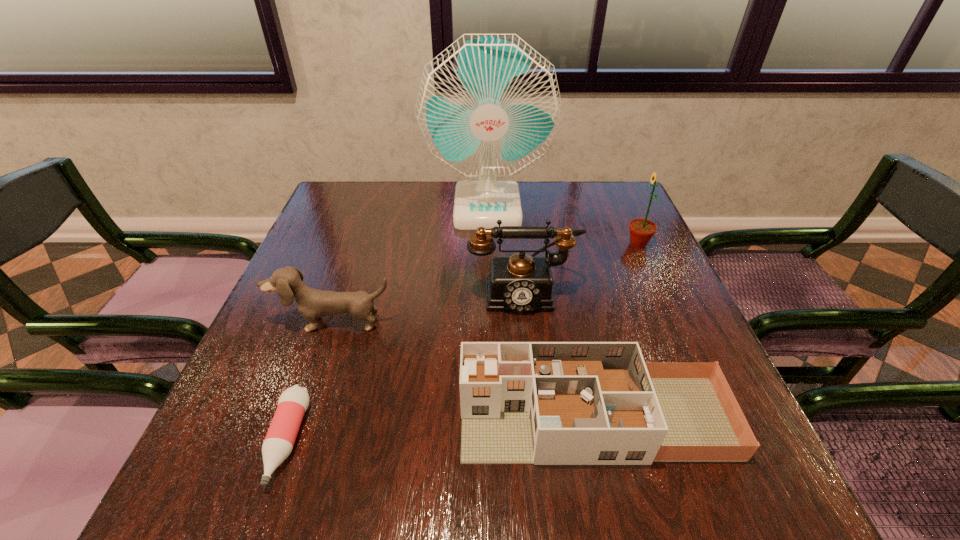
Where is `bottle that is positioned at the left edge`? bottle that is positioned at the left edge is located at coordinates (279, 441).

Where is `sunflower located in the right edge section of the desktop`? The image size is (960, 540). sunflower located in the right edge section of the desktop is located at coordinates (641, 230).

At what (x,y) coordinates should I click in order to perform the action: click on dollhouse that is positioned at the right edge. Please return your answer as a coordinate pair (x, y). Looking at the image, I should click on (545, 403).

This screenshot has width=960, height=540. I want to click on object positioned at the near left corner, so click(x=279, y=441).

The height and width of the screenshot is (540, 960). Find the location of `object situated at the near right corner`. object situated at the near right corner is located at coordinates (545, 403).

Where is `free space at the far edge of the desktop`? The height and width of the screenshot is (540, 960). free space at the far edge of the desktop is located at coordinates (398, 181).

The height and width of the screenshot is (540, 960). In the image, there is a desktop. Find the location of `free region at the left edge`. free region at the left edge is located at coordinates (365, 252).

In order to click on vacant space at the right edge of the desktop in this screenshot , I will do `click(599, 229)`.

Identify the location of blank space at the far left corner of the desktop. The width and height of the screenshot is (960, 540). 371,191.

Image resolution: width=960 pixels, height=540 pixels. Find the location of `free space between the bottle and the farthest object`. free space between the bottle and the farthest object is located at coordinates (387, 324).